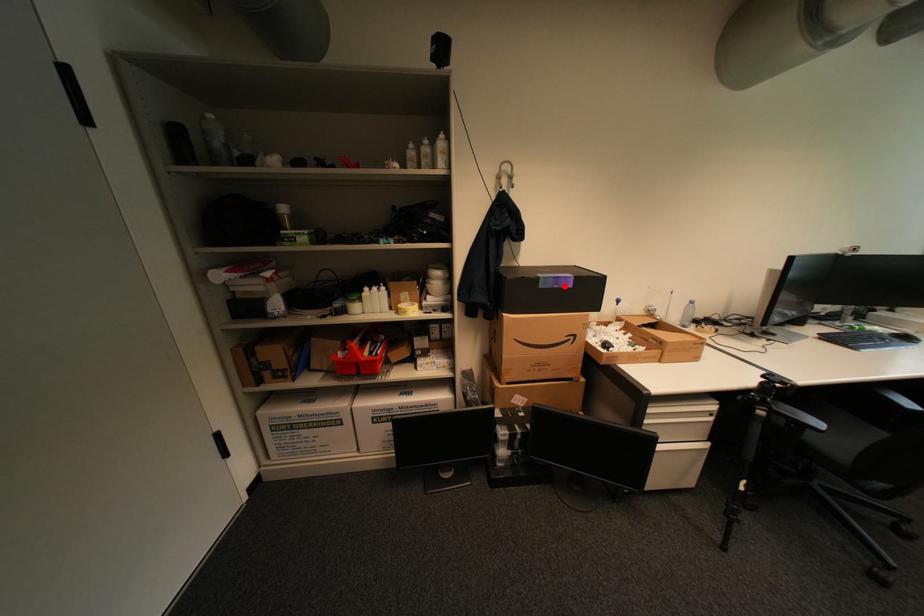
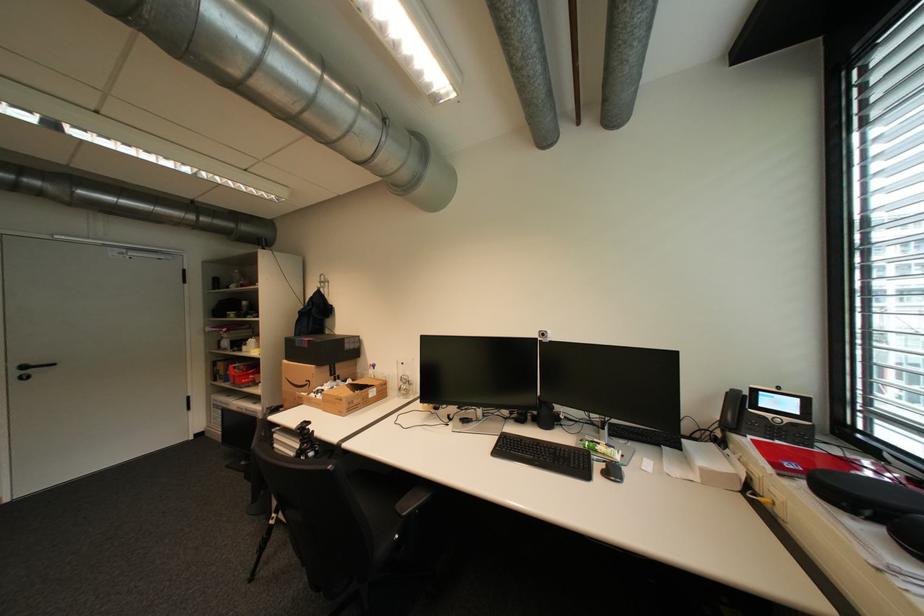
Locate, in the second image, the point that corresponds to the highlighted location in the first image.

(310, 346)